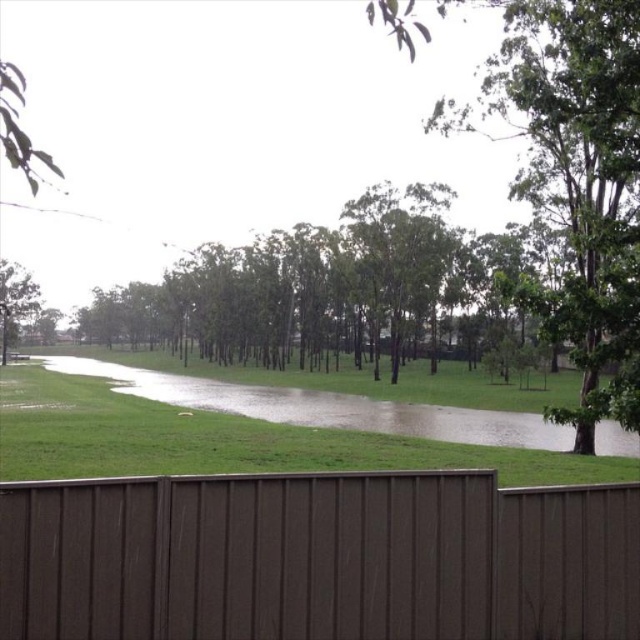
You are standing in the residential area shown in the image. You want to locate the green leafy tree at upper right. Based on the coordinates provided, where should you look?

The green leafy tree at upper right is located at point 0.277 on the x axis and 0.900 on the y axis.

You are standing at the point marked as point (576, 177) in the image. What object are you standing on?

You are standing on the green leafy tree at upper right.

You are standing in front of the brown corrugated metal fence in the foreground. You want to know which object, the green leafy tree at upper right or the green grassy water at center, is bigger in the image. Which one is larger?

The green leafy tree at upper right is larger than the green grassy water at center.